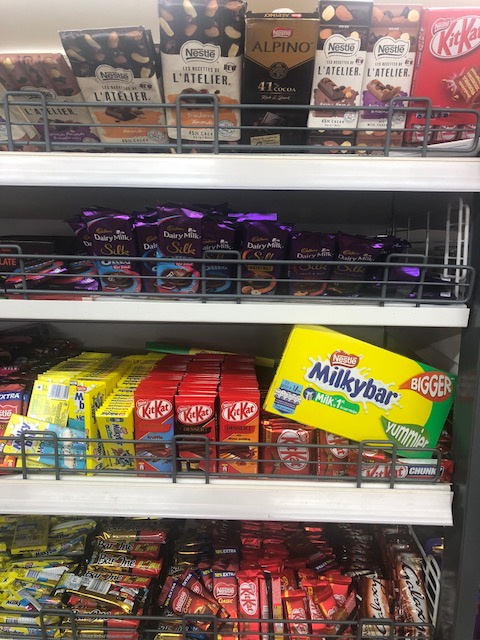
This screenshot has width=480, height=640. I want to click on shelves, so click(x=214, y=301), click(x=212, y=490), click(x=234, y=168), click(x=208, y=470).